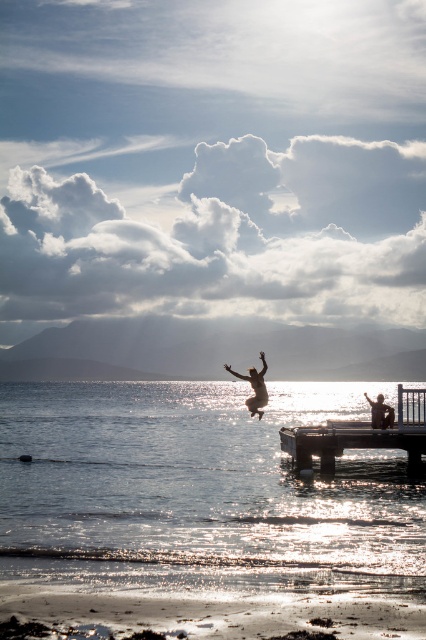
The image size is (426, 640). Describe the element at coordinates (199, 490) in the screenshot. I see `silvery reflective water at center` at that location.

Which is more to the right, silvery reflective water at center or silhouette human at right?

Positioned to the right is silhouette human at right.

Which is in front, point (279, 392) or point (376, 416)?

Point (376, 416)

Where is `silvery reflective water at center`? The height and width of the screenshot is (640, 426). silvery reflective water at center is located at coordinates (199, 490).

Describe the element at coordinates (360, 435) in the screenshot. I see `wooden dock at center` at that location.

Where is `wooden dock at center`? wooden dock at center is located at coordinates (360, 435).

Can you confirm if silhouette human at center is positioned below silhouette human at right?

No.

In order to click on silhouette human at center in this screenshot , I will do `click(255, 387)`.